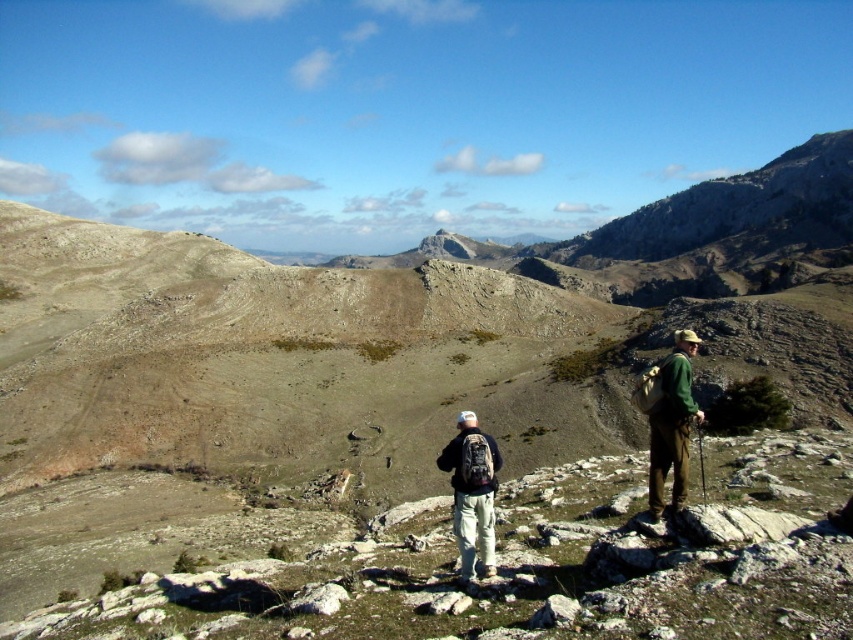
Who is positioned more to the right, green fabric backpack at right or dark gray backpack at center?

green fabric backpack at right is more to the right.

Measure the distance between green fabric backpack at right and dark gray backpack at center.

The distance of green fabric backpack at right from dark gray backpack at center is 31.01 feet.

Identify the location of green fabric backpack at right. This screenshot has width=853, height=640. (672, 422).

Image resolution: width=853 pixels, height=640 pixels. Find the location of `green fabric backpack at right`. green fabric backpack at right is located at coordinates (672, 422).